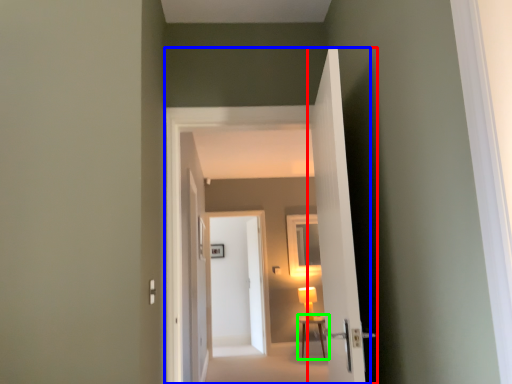
Question: Based on their relative distances, which object is farther from door (highlighted by a red box)? Choose from corridor (highlighted by a blue box) and table (highlighted by a green box).

Choices:
 (A) corridor
 (B) table

Answer: (B)